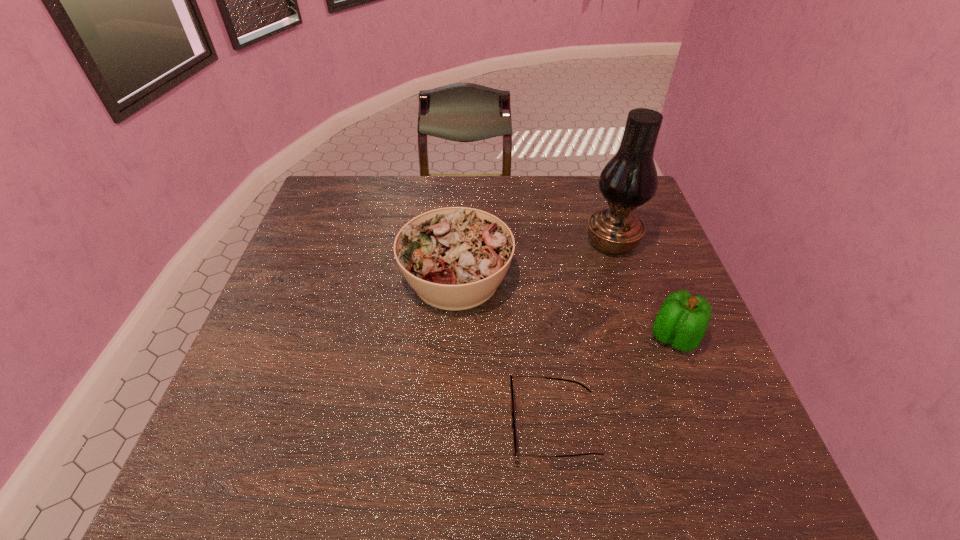
Locate an element on the screen. This screenshot has height=540, width=960. free point between the nearest object and the oil lamp is located at coordinates (583, 334).

Locate an element on the screen. This screenshot has height=540, width=960. object that is the closest to the bell pepper is located at coordinates (514, 446).

Locate an element on the screen. object that stands as the third closest to the tallest object is located at coordinates (514, 446).

You are a GUI agent. You are given a task and a screenshot of the screen. Output one action in this format:
    pyautogui.click(x=<x>, y=<y>)
    Task: Click on the vacant space that satisfies the following two spatial constraints: 1. on the front side of the bell pepper; 2. on the face of the shortest object
    This screenshot has width=960, height=540.
    Given the screenshot: What is the action you would take?
    pyautogui.click(x=708, y=425)